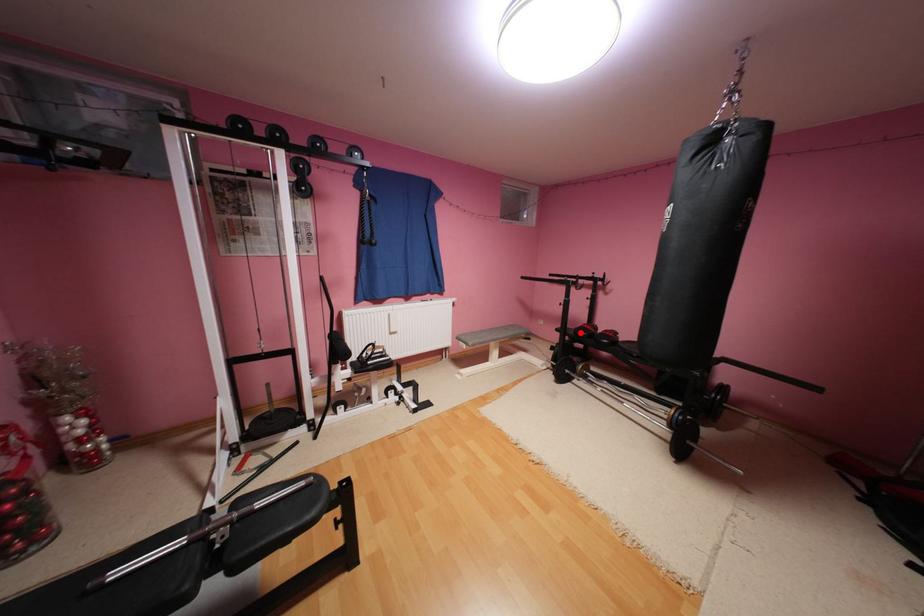
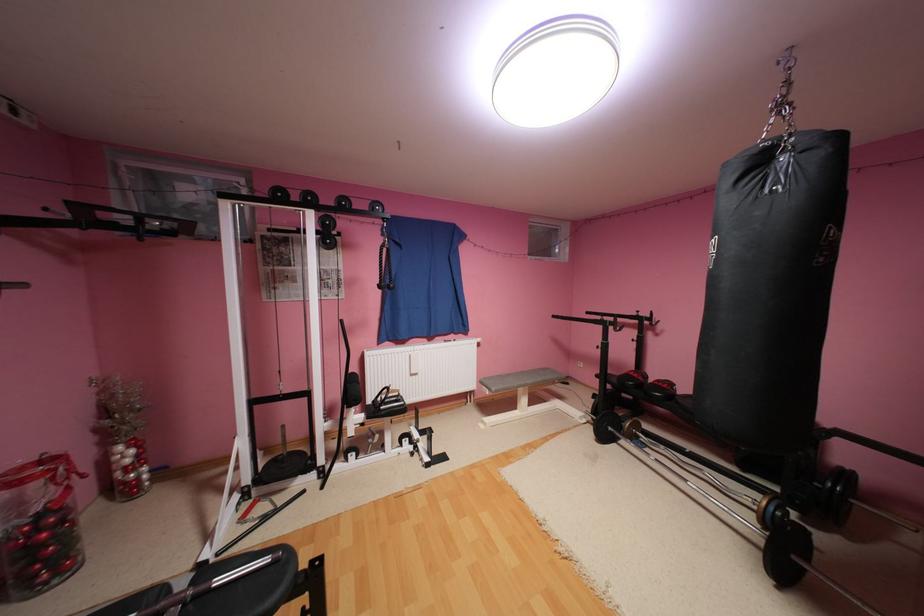
Find the pixel in the second image that matches the highlighted location in the first image.

(624, 379)